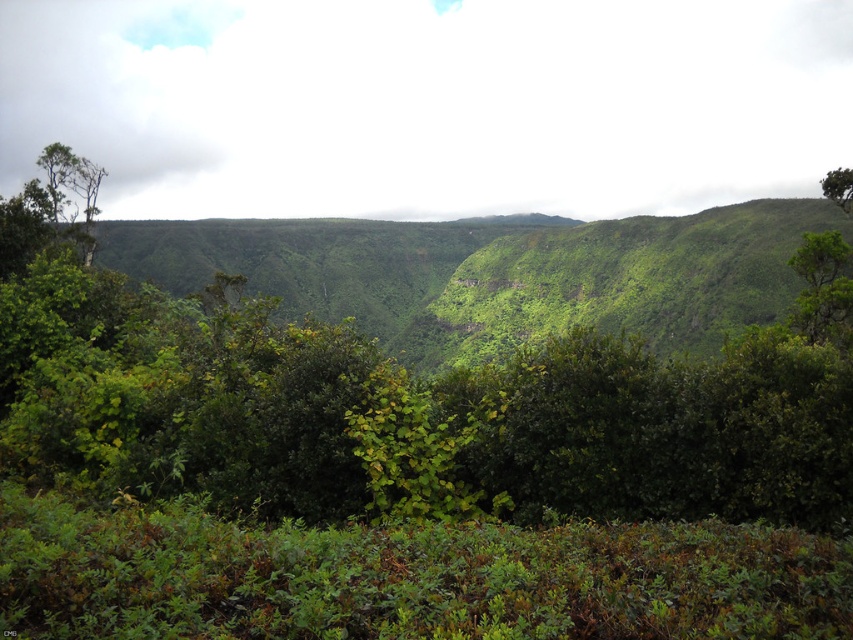
You are an airplane pilot flying over the lush landscape. You notice the white fluffy cloud at upper center and the green leafy tree at upper right. Which object is wider from your aerial view?

The white fluffy cloud at upper center might be wider than green leafy tree at upper right based on the description provided.

You are standing in the lush landscape described. You see a point marked at coordinates (822, 289). What object is located at that point?

The point at coordinates (822, 289) indicates a green leafy tree at the right.

In the scene shown: You are standing in the lush landscape and want to walk from the point at coordinates (21, 45) to the point at coordinates (846, 189). Which direction should you move to get closer to your destination?

You should move away from the camera because point (21, 45) is further to the camera than point (846, 189). Moving away from the camera will take you towards the destination.